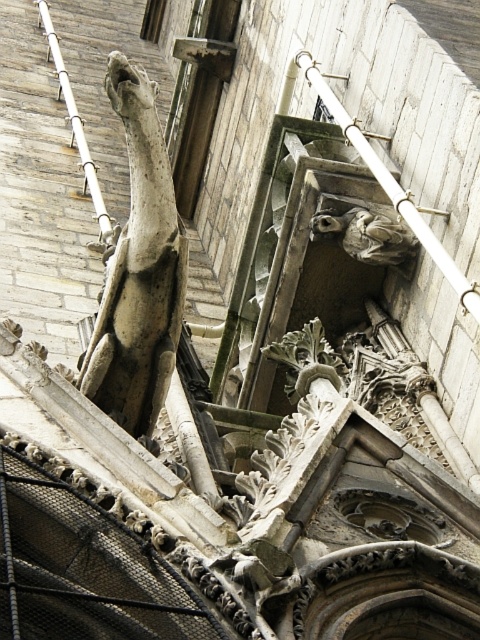
Question: Is gray stone gargoyle at upper left to the right of gray stone gargoyle at upper center from the viewer's perspective?

Choices:
 (A) yes
 (B) no

Answer: (B)

Question: Does gray stone gargoyle at upper left appear under gray stone gargoyle at upper center?

Choices:
 (A) no
 (B) yes

Answer: (B)

Question: Is gray stone gargoyle at upper left bigger than gray stone gargoyle at upper center?

Choices:
 (A) no
 (B) yes

Answer: (B)

Question: Which object appears closest to the camera in this image?

Choices:
 (A) gray stone gargoyle at upper center
 (B) gray stone gargoyle at upper left

Answer: (B)